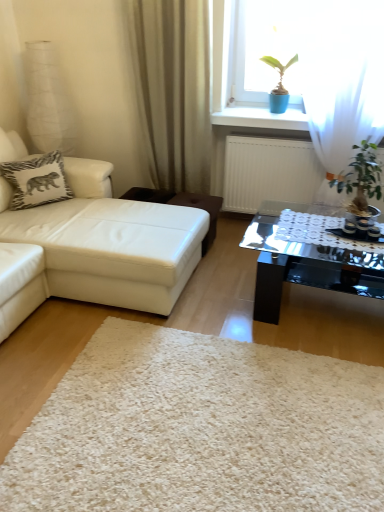
Find the location of a particular element. vacant location below transparent glass coffee table at center (from a real-world perspective) is located at coordinates (326, 316).